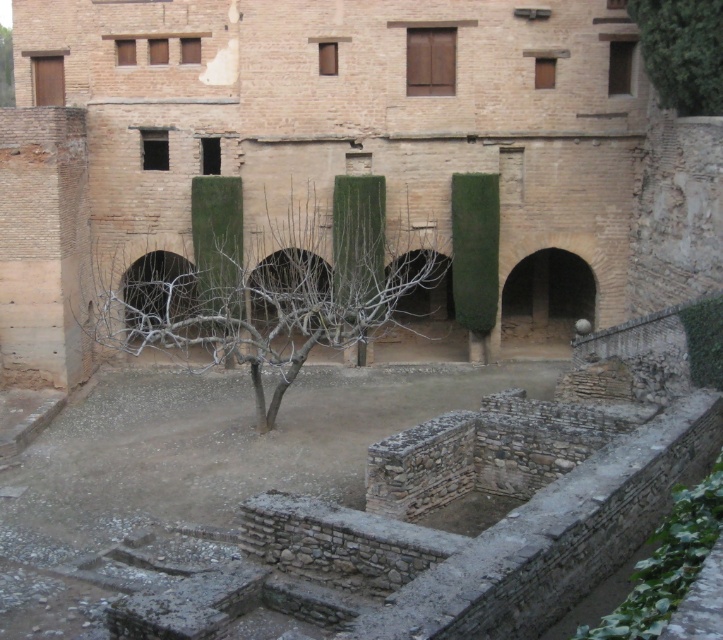
Question: Among these objects, which one is farthest from the camera?

Choices:
 (A) brown stone ruins at center
 (B) bare branches at center
 (C) green leafy tree at upper right

Answer: (A)

Question: Can you confirm if green leafy tree at upper right is smaller than green leafy tree at upper left?

Choices:
 (A) no
 (B) yes

Answer: (B)

Question: Is brown stone ruins at center to the right of green leafy tree at upper left from the viewer's perspective?

Choices:
 (A) yes
 (B) no

Answer: (A)

Question: Is brown stone ruins at center above green leafy tree at upper right?

Choices:
 (A) yes
 (B) no

Answer: (B)

Question: Estimate the real-world distances between objects in this image. Which object is closer to the bare branches at center?

Choices:
 (A) green leafy tree at upper left
 (B) green leafy tree at upper right

Answer: (B)

Question: Considering the real-world distances, which object is farthest from the green leafy tree at upper left?

Choices:
 (A) brown stone ruins at center
 (B) bare branches at center
 (C) green leafy tree at upper right

Answer: (C)